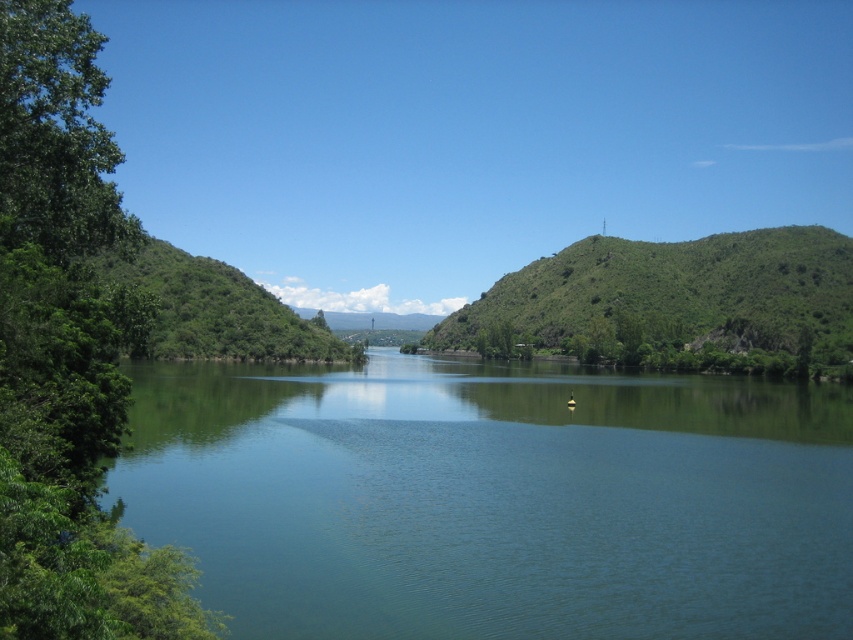
You are standing at the edge of the green smooth water at center and want to walk to the green leafy tree at left. Which direction should you head towards?

You should head towards the left to reach the green leafy tree at left since it is located at the left side of the green smooth water at center.

You are standing at the edge of the green smooth water at center, and you want to throw a pebble to see how far it travels before hitting the water. If your throw can reach up to 30 meters, will the pebble land in the water?

The distance between you and the green smooth water at center is 31.20 meters. Since your throw can only reach 30 meters, the pebble will not land in the water.

You are standing at the edge of the scene and want to walk towards the green leafy tree at left. Will the green smooth water at center block your path?

The green smooth water at center is shorter than the green leafy tree at left, so it might not block your path. However, since the water is at the center, you might need to walk around it to reach the tree.